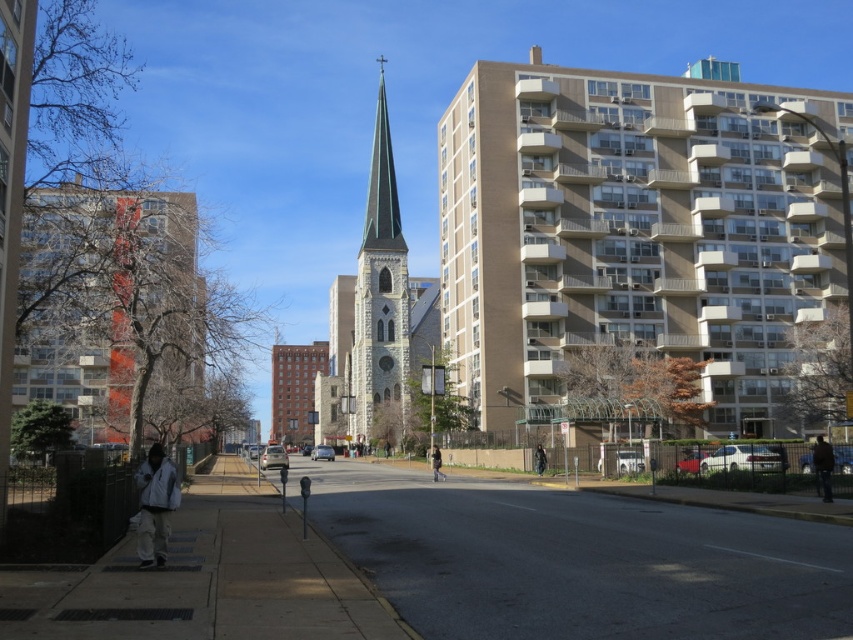
Which is more to the left, gray stone church steeple at center or dark gray pants at center?

From the viewer's perspective, gray stone church steeple at center appears more on the left side.

The height and width of the screenshot is (640, 853). Identify the location of gray stone church steeple at center. (375, 317).

The height and width of the screenshot is (640, 853). What do you see at coordinates (375, 317) in the screenshot?
I see `gray stone church steeple at center` at bounding box center [375, 317].

At what (x,y) coordinates should I click in order to perform the action: click on gray stone church steeple at center. Please return your answer as a coordinate pair (x, y). This screenshot has height=640, width=853. Looking at the image, I should click on click(x=375, y=317).

Describe the element at coordinates (106, 298) in the screenshot. I see `orange brick church at left` at that location.

Does orange brick church at left appear under gray stone spire at center?

Yes.

What are the coordinates of `orange brick church at left` in the screenshot? It's located at (106, 298).

Where is `orange brick church at left`? The height and width of the screenshot is (640, 853). orange brick church at left is located at coordinates (106, 298).

Between stone steeple at center and orange brick church at left, which one has more height?

stone steeple at center is taller.

Can you confirm if stone steeple at center is positioned below orange brick church at left?

No.

Is point (798, 273) farther from viewer compared to point (55, 234)?

Yes, it is.

Identify the location of stone steeple at center. Image resolution: width=853 pixels, height=640 pixels. (633, 228).